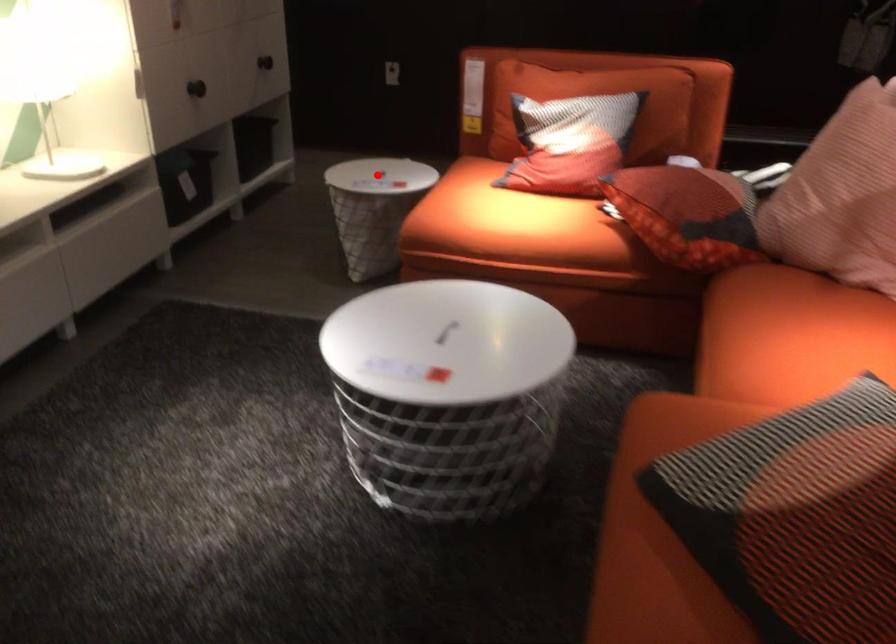
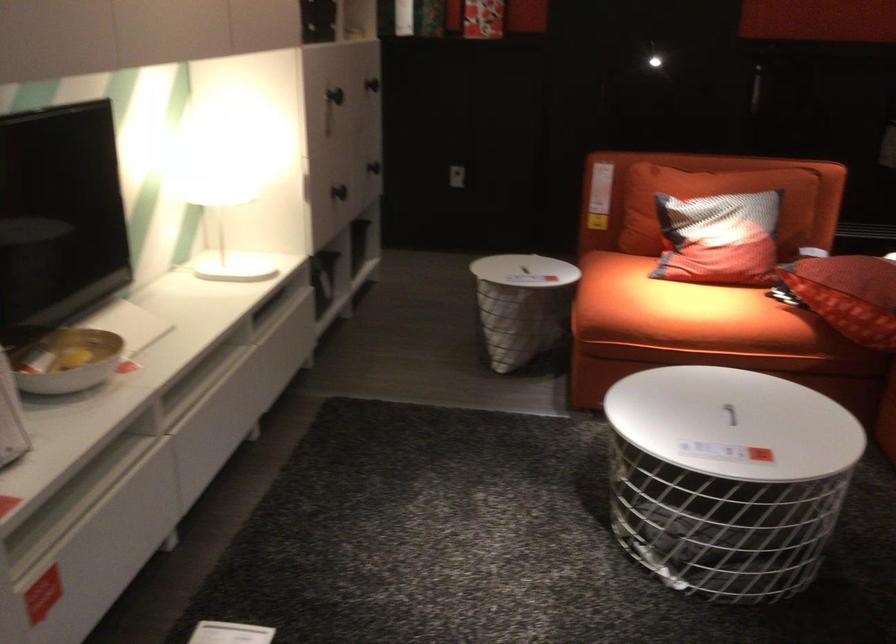
The point at the highlighted location is marked in the first image. Where is the corresponding point in the second image?

(522, 270)